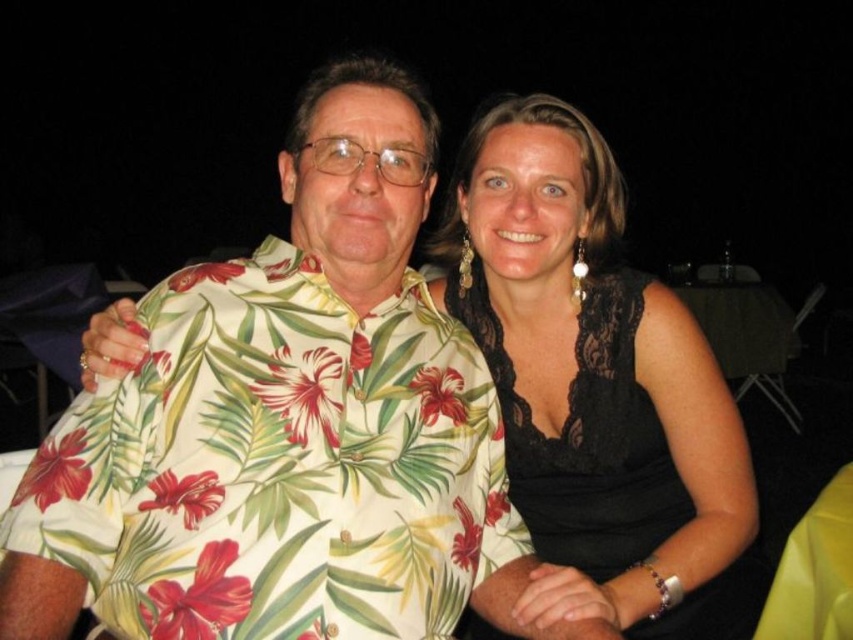
You are a photographer trying to frame two subjects in the center of the image. The subjects are wearing a floral print fabric shirt at center and a black lace dress at center. Since you want to ensure both are visible, which subject should you position slightly to the side to avoid overcrowding?

The floral print fabric shirt at center should be positioned slightly to the side because it is wider than the black lace dress at center, so moving it away from the center will prevent overcrowding.

You are a photographer trying to decide where to place a small stool for someone to stand on during a photoshoot. You notice the floral print fabric shirt at center and the black lace dress at center. Which clothing item is shorter in length, requiring the stool to be placed closer to the ground?

The floral print fabric shirt at center is shorter than the black lace dress at center, so the stool should be placed closer to the ground to accommodate the shorter floral print fabric shirt at center.

You are a photographer adjusting the lighting for a night portrait. You notice the floral print fabric shirt at center and the black lace dress at center. Which clothing item is positioned lower in the frame?

The floral print fabric shirt at center is located below the black lace dress at center, so it is positioned lower in the frame.